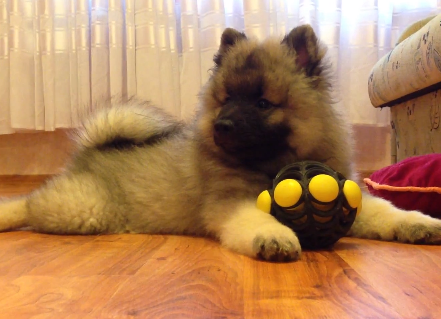
Image resolution: width=441 pixels, height=319 pixels. Find the location of `tree rings on wooden floor`. tree rings on wooden floor is located at coordinates (206, 291), (354, 285).